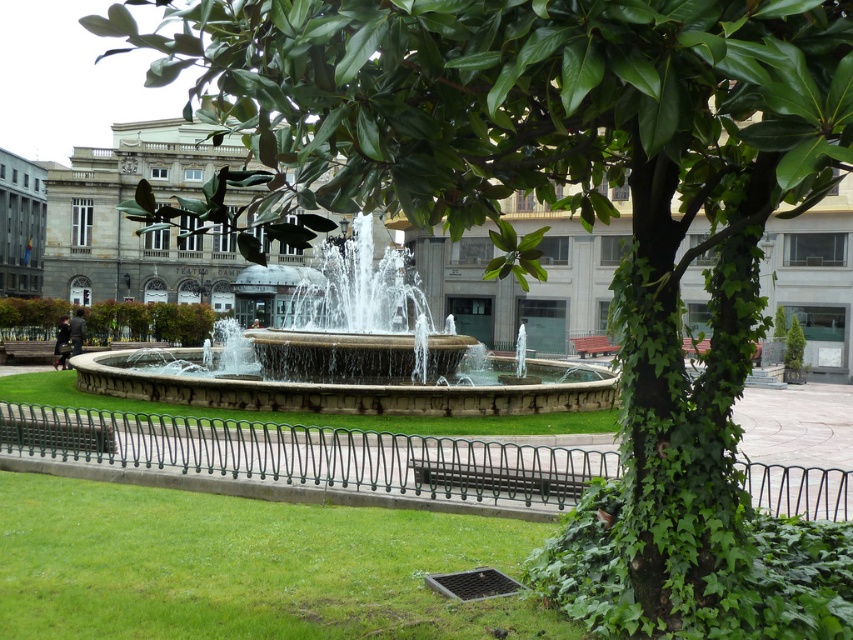
Question: Which of the following is the closest to the observer?

Choices:
 (A) (288, 602)
 (B) (294, 317)

Answer: (A)

Question: Which point is closer to the camera?

Choices:
 (A) (578, 344)
 (B) (345, 540)
 (C) (306, 300)

Answer: (B)

Question: Can you confirm if green grass at lower left is positioned below stone fountain at center?

Choices:
 (A) yes
 (B) no

Answer: (A)

Question: Does green grass at lower left come behind wooden bench at center?

Choices:
 (A) yes
 (B) no

Answer: (B)

Question: Does green grass at lower left have a lesser width compared to wooden bench at center?

Choices:
 (A) yes
 (B) no

Answer: (B)

Question: Based on their relative distances, which object is nearer to the stone fountain at center?

Choices:
 (A) green grass at lower left
 (B) wooden bench at center

Answer: (B)